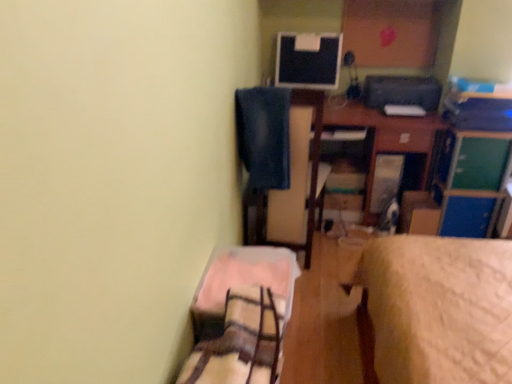
Question: In the image, is green matte file cabinet at upper right on the left side or the right side of blue fabric swivel chair at upper center?

Choices:
 (A) right
 (B) left

Answer: (A)

Question: From a real-world perspective, is green matte file cabinet at upper right above or below blue fabric swivel chair at upper center?

Choices:
 (A) above
 (B) below

Answer: (B)

Question: Which of these objects is positioned closest to the wooden desk at center?

Choices:
 (A) matte black monitor at upper center
 (B) blue fabric swivel chair at upper center
 (C) green matte file cabinet at upper right
 (D) plaid fabric bed at lower left
 (E) cardboard box at center

Answer: (C)

Question: Based on their relative distances, which object is farther from the matte black monitor at upper center?

Choices:
 (A) wooden desk at center
 (B) blue fabric swivel chair at upper center
 (C) green matte file cabinet at upper right
 (D) plaid fabric bed at lower left
 (E) cardboard box at center

Answer: (D)